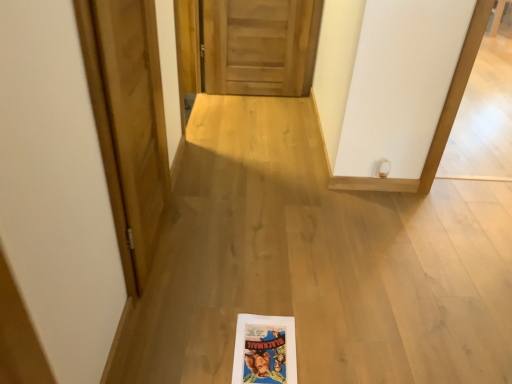
Locate an element on the screen. The image size is (512, 384). unoccupied area behind wooden door at left, the second door viewed from the right is located at coordinates pyautogui.click(x=205, y=193).